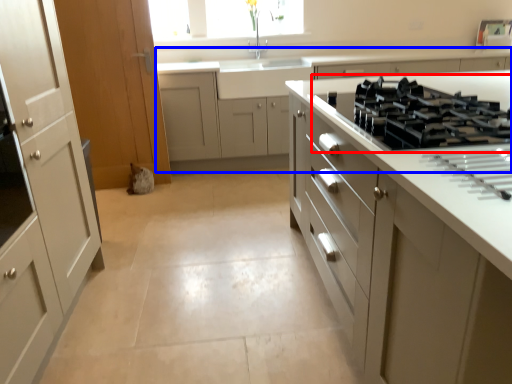
Question: Among these objects, which one is farthest to the camera, gas stove (highlighted by a red box) or cabinetry (highlighted by a blue box)?

Choices:
 (A) gas stove
 (B) cabinetry

Answer: (B)